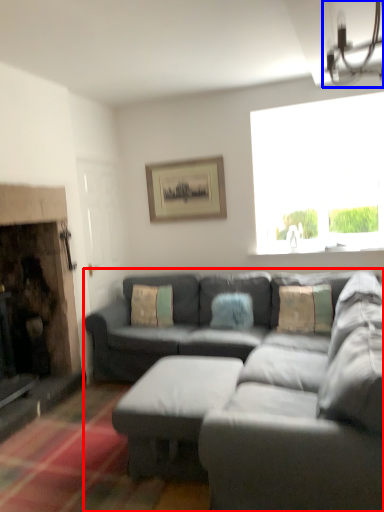
Question: Which object appears closest to the camera in this image, studio couch (highlighted by a red box) or light fixture (highlighted by a blue box)?

Choices:
 (A) studio couch
 (B) light fixture

Answer: (A)